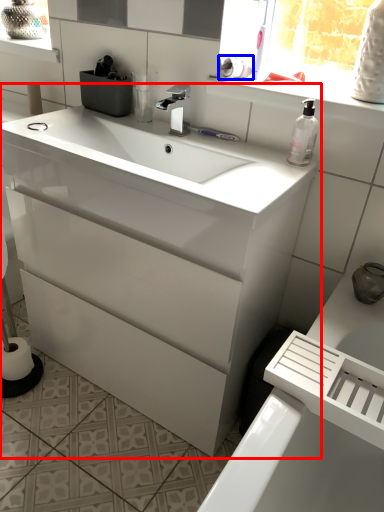
Question: Which of the following is the closest to the observer, bathroom cabinet (highlighted by a red box) or toilet paper (highlighted by a blue box)?

Choices:
 (A) bathroom cabinet
 (B) toilet paper

Answer: (A)